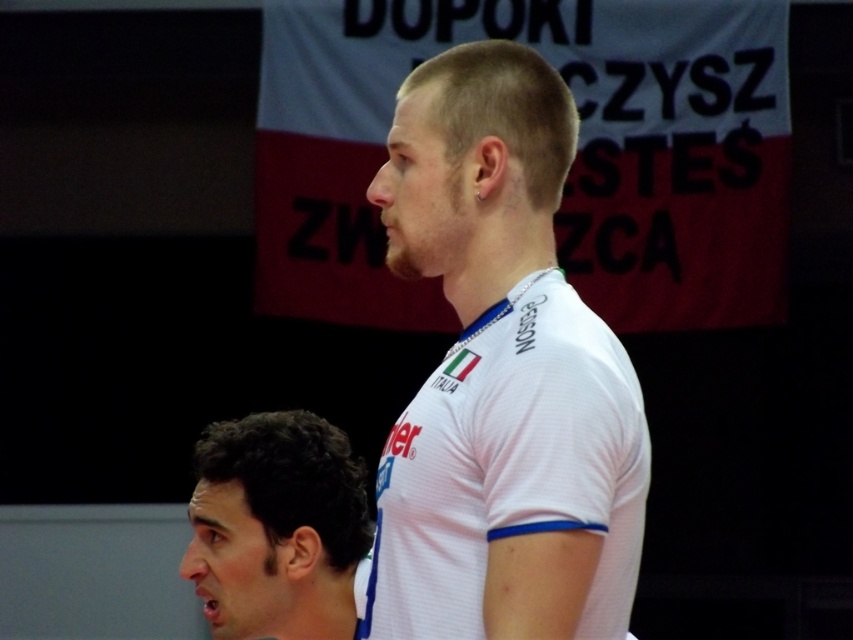
Is white jersey at center taller than dark curly hair at lower left?

Indeed, white jersey at center has a greater height compared to dark curly hair at lower left.

Does white jersey at center appear on the right side of dark curly hair at lower left?

Indeed, white jersey at center is positioned on the right side of dark curly hair at lower left.

Who is more forward, (531, 72) or (328, 588)?

Point (531, 72)

I want to click on white jersey at center, so click(502, 376).